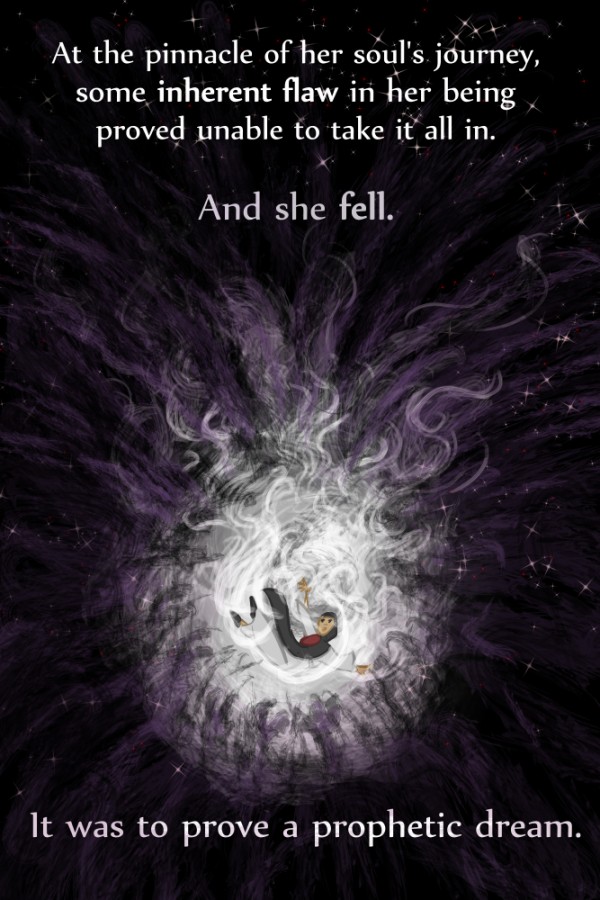
Locate an element on the screen. The image size is (600, 900). white robe is located at coordinates pos(342,662), pos(286,657).